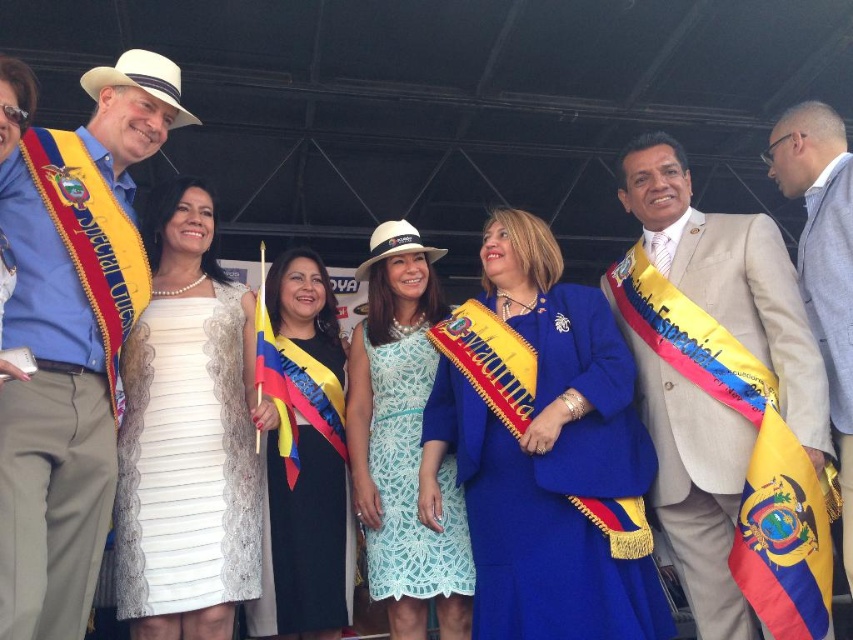
Is point (834, 429) closer to camera compared to point (798, 621)?

No.

Is gray wool blazer at right further to the viewer compared to yellow and red fabric flag at lower right?

Yes, it is.

Which is behind, point (817, 285) or point (751, 554)?

Point (817, 285)

Find the location of `gray wool blazer at right`. gray wool blazer at right is located at coordinates (822, 260).

Can you confirm if blue woolen coat at center is positioned above lace fabric dress at center?

Correct, blue woolen coat at center is located above lace fabric dress at center.

Who is positioned more to the right, blue woolen coat at center or lace fabric dress at center?

Positioned to the right is blue woolen coat at center.

Image resolution: width=853 pixels, height=640 pixels. In order to click on blue woolen coat at center in this screenshot , I will do `click(544, 454)`.

Find the location of a particular element. The image size is (853, 640). blue woolen coat at center is located at coordinates (544, 454).

Who is higher up, beige textured suit at center or lace fabric dress at center?

beige textured suit at center is higher up.

Does beige textured suit at center have a greater width compared to lace fabric dress at center?

Correct, the width of beige textured suit at center exceeds that of lace fabric dress at center.

This screenshot has width=853, height=640. Describe the element at coordinates (724, 400) in the screenshot. I see `beige textured suit at center` at that location.

I want to click on beige textured suit at center, so click(x=724, y=400).